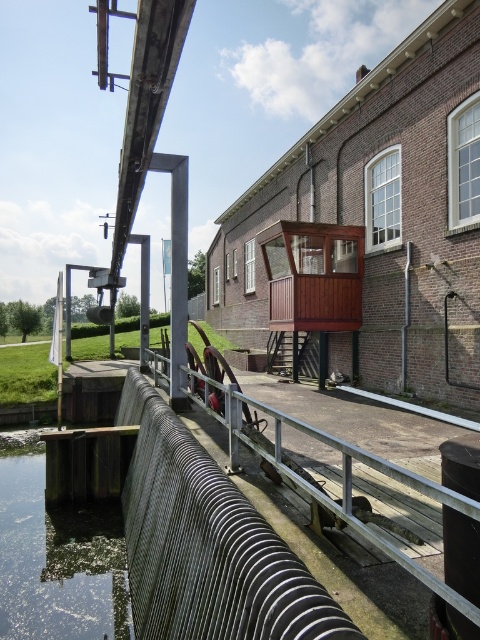
In the scene shown: Is green algae-covered water at lower left smaller than metallic ribbed rail at center?

Correct, green algae-covered water at lower left occupies less space than metallic ribbed rail at center.

Who is positioned more to the right, green algae-covered water at lower left or metallic ribbed rail at center?

metallic ribbed rail at center is more to the right.

Describe the element at coordinates (58, 561) in the screenshot. I see `green algae-covered water at lower left` at that location.

The image size is (480, 640). Identify the location of green algae-covered water at lower left. (58, 561).